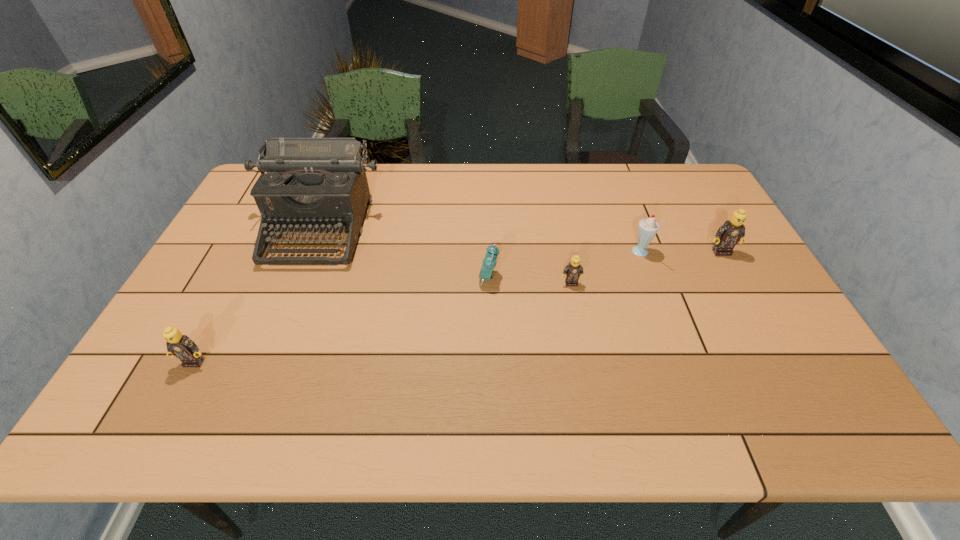
This screenshot has height=540, width=960. I want to click on object that is the third closest to the fifth object from left to right, so click(x=489, y=262).

The width and height of the screenshot is (960, 540). Identify the location of Lego identified as the second closest to the second object from right to left. (572, 272).

Where is `Lego that is the second closest one to the alarm clock`? This screenshot has width=960, height=540. Lego that is the second closest one to the alarm clock is located at coordinates (732, 231).

You are a GUI agent. You are given a task and a screenshot of the screen. Output one action in this format:
    pyautogui.click(x=<x>, y=<y>)
    Task: Click on the free space in the image that satisfies the following two spatial constraints: 1. on the straw side of the milkshake; 2. in front of the shortest Lego
    This screenshot has width=960, height=540.
    Given the screenshot: What is the action you would take?
    pyautogui.click(x=652, y=284)

You are a GUI agent. You are given a task and a screenshot of the screen. Output one action in this format:
    pyautogui.click(x=<x>, y=<y>)
    Task: Click on the vacant area in the image that satisfies the following two spatial constraints: 1. on the straw side of the milkshake; 2. in front of the fourth object from left to right
    The image size is (960, 540).
    Given the screenshot: What is the action you would take?
    pyautogui.click(x=652, y=284)

Locate an element on the screen. This screenshot has width=960, height=540. free location that satisfies the following two spatial constraints: 1. in front of the rightmost object; 2. on the face of the alarm clock is located at coordinates point(735,278).

Identify the location of vacant space that satisfies the following two spatial constraints: 1. in front of the rightmost Lego; 2. on the face of the fourth object from right to left. Image resolution: width=960 pixels, height=540 pixels. (735, 278).